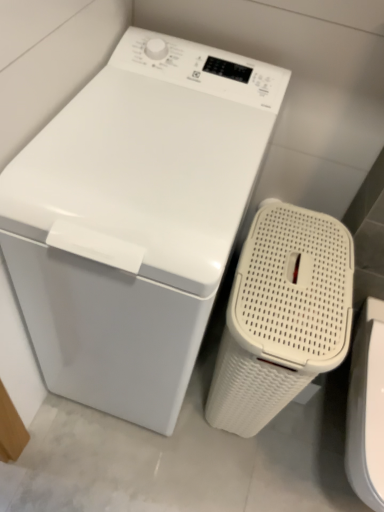
Question: Is white glossy washing machine at center further to camera compared to white woven laundry basket at right?

Choices:
 (A) yes
 (B) no

Answer: (B)

Question: Does white glossy washing machine at center have a lesser height compared to white woven laundry basket at right?

Choices:
 (A) no
 (B) yes

Answer: (A)

Question: Is the position of white glossy washing machine at center less distant than that of white woven laundry basket at right?

Choices:
 (A) yes
 (B) no

Answer: (A)

Question: Is white glossy washing machine at center thinner than white woven laundry basket at right?

Choices:
 (A) no
 (B) yes

Answer: (A)

Question: Is white glossy washing machine at center outside of white woven laundry basket at right?

Choices:
 (A) no
 (B) yes

Answer: (B)

Question: Is white glossy washing machine at center looking in the opposite direction of white woven laundry basket at right?

Choices:
 (A) no
 (B) yes

Answer: (A)

Question: Is white woven laundry basket at right not within white glossy washing machine at center?

Choices:
 (A) no
 (B) yes

Answer: (B)

Question: Does white woven laundry basket at right appear on the right side of white glossy washing machine at center?

Choices:
 (A) no
 (B) yes

Answer: (B)

Question: Does white woven laundry basket at right have a smaller size compared to white glossy washing machine at center?

Choices:
 (A) yes
 (B) no

Answer: (A)

Question: Is white woven laundry basket at right turned away from white glossy washing machine at center?

Choices:
 (A) yes
 (B) no

Answer: (B)

Question: Is white woven laundry basket at right positioned before white glossy washing machine at center?

Choices:
 (A) yes
 (B) no

Answer: (B)

Question: Are white woven laundry basket at right and white glossy washing machine at center beside each other?

Choices:
 (A) yes
 (B) no

Answer: (B)

Question: Do you think white glossy washing machine at center is within white woven laundry basket at right, or outside of it?

Choices:
 (A) outside
 (B) inside

Answer: (A)